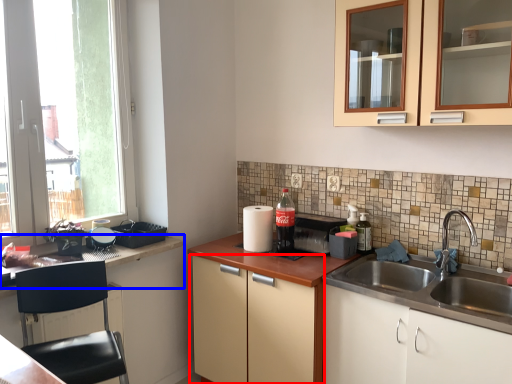
Question: Which point is further to the camera, cabinetry (highlighted by a red box) or countertop (highlighted by a blue box)?

Choices:
 (A) cabinetry
 (B) countertop

Answer: (A)